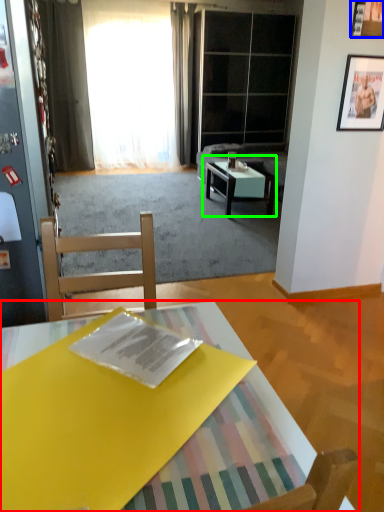
Question: Which is farther away from coffee table (highlighted by a red box)? picture frame (highlighted by a blue box) or coffee table (highlighted by a green box)?

Choices:
 (A) picture frame
 (B) coffee table

Answer: (B)